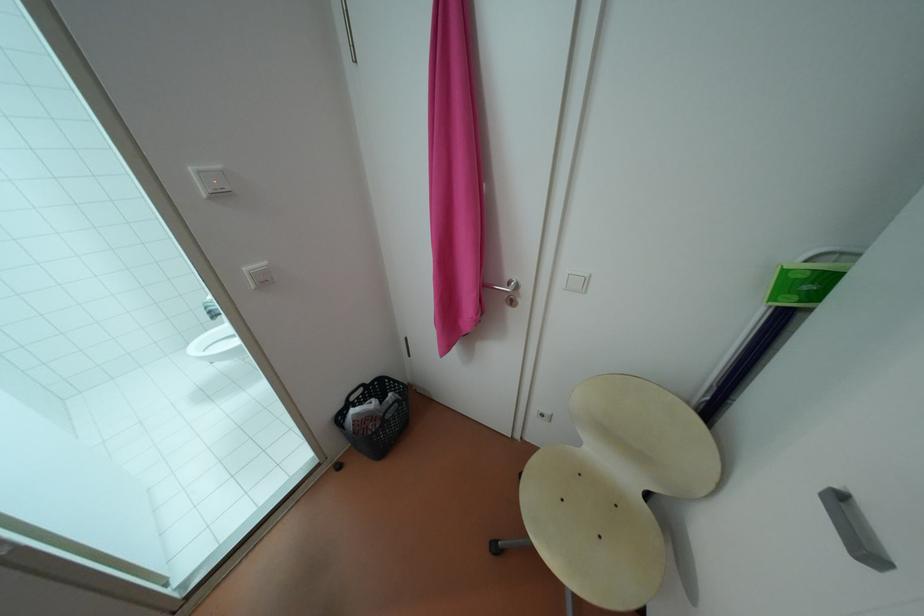
What do you see at coordinates (506, 291) in the screenshot? The width and height of the screenshot is (924, 616). I see `the silver door handle` at bounding box center [506, 291].